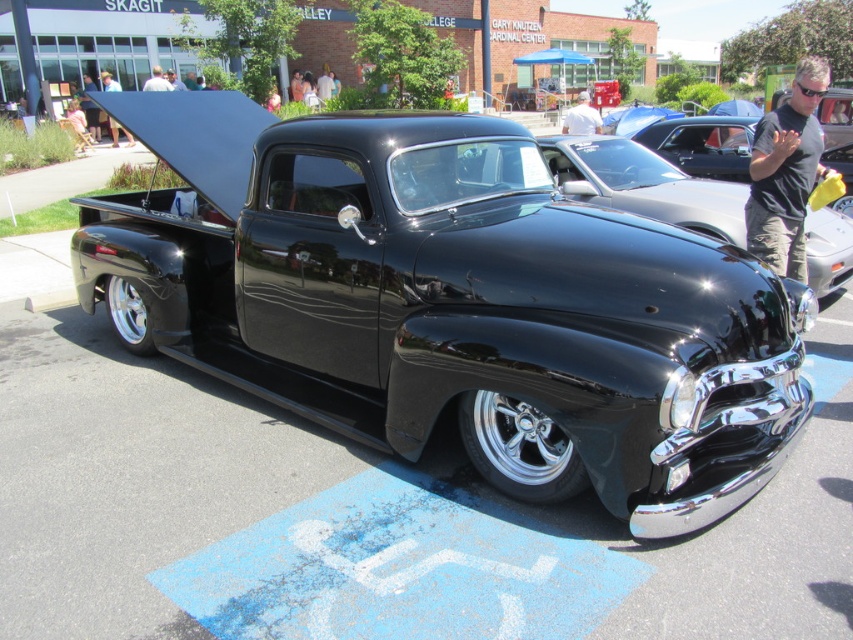
In the scene shown: You are standing in front of a classic black pickup truck parked in a public parking lot. You see a point labeled as point (666, 188). Can you tell me how far this point is from you?

The point (666, 188) is 6.98 meters away from the camera, so it is approximately 6.98 meters away from you.